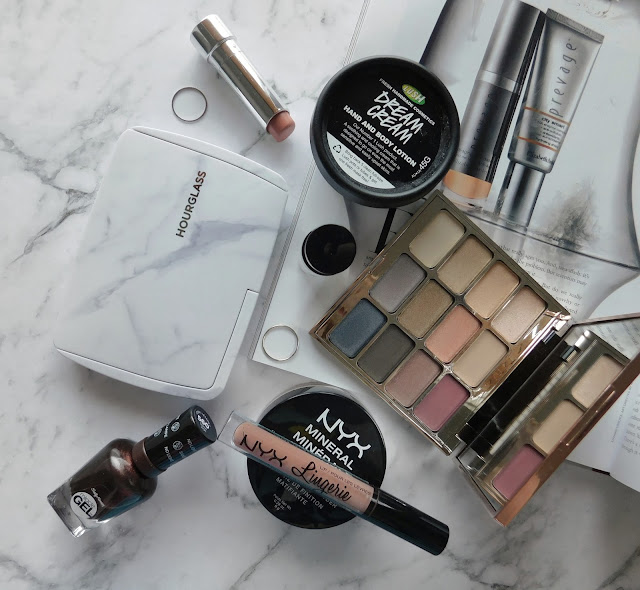
You are a GUI agent. You are given a task and a screenshot of the screen. Output one action in this format:
    pyautogui.click(x=<x>, y=<y>)
    Task: Click on the granite countertop
    The height and width of the screenshot is (590, 640).
    Given the screenshot: What is the action you would take?
    pyautogui.click(x=40, y=131)